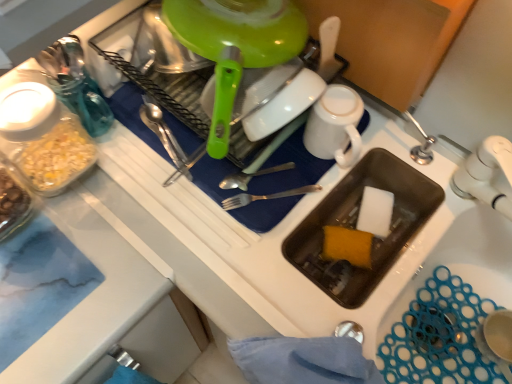
Where is `spots to the right of shiny metal spoon at center`? The height and width of the screenshot is (384, 512). spots to the right of shiny metal spoon at center is located at coordinates (278, 157).